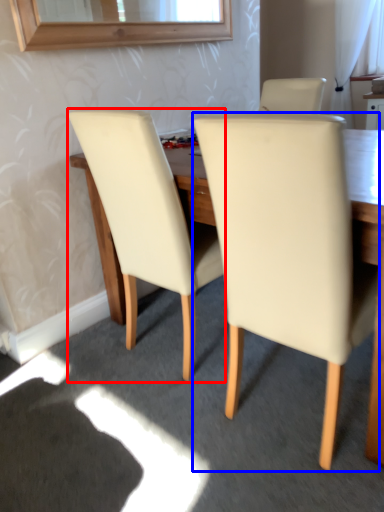
Question: Which object appears farthest to the camera in this image, chair (highlighted by a red box) or chair (highlighted by a blue box)?

Choices:
 (A) chair
 (B) chair

Answer: (A)